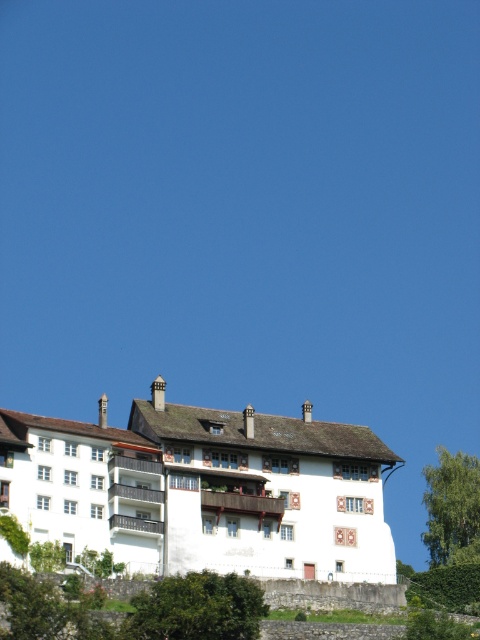
You are standing at the point marked as point (x=196, y=609). What is the nearest object to you in the scene?

The nearest object to you is the green leafy tree at lower center because the point is located on it.

You are standing in front of the picturesque building and looking at two points marked on the image. The first point is at coordinates point (140, 632) and the second is at point (468, 454). Which point is closer to you?

Point (140, 632) is closer to the camera than point (468, 454). Therefore, the first point is closer to you.